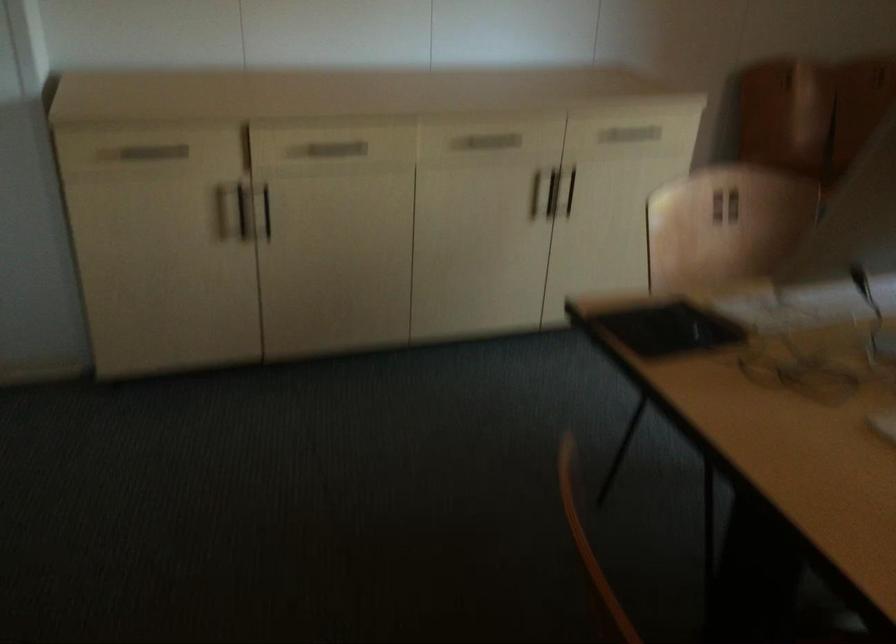
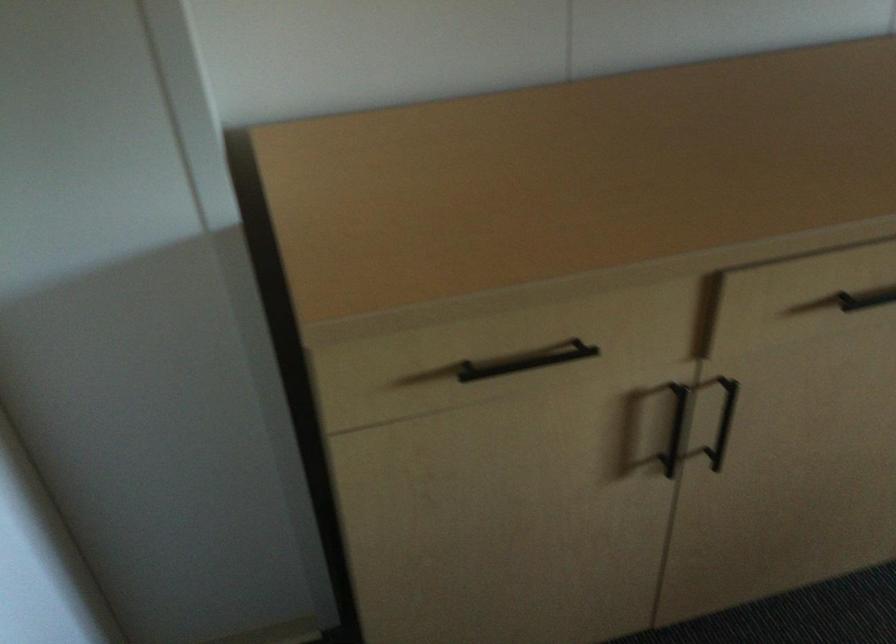
Locate, in the second image, the point that corresponds to point 326,152 in the first image.

(866, 299)